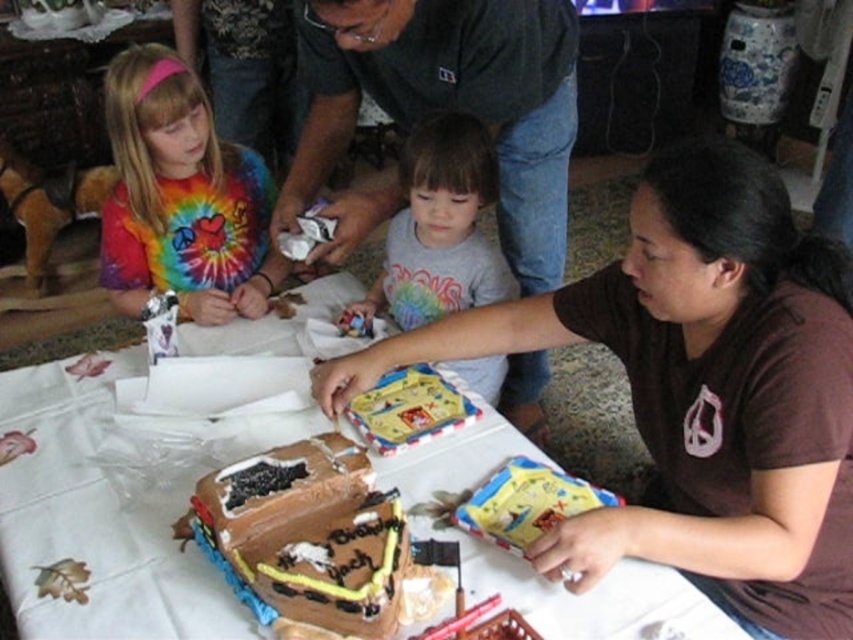
Between dark gray shirt at center and rainbow tie-dye shirt at center, which one has less height?

rainbow tie-dye shirt at center is shorter.

From the picture: Does dark gray shirt at center have a lesser height compared to rainbow tie-dye shirt at center?

No.

Is point (350, 42) in front of point (494, 246)?

Yes, it is in front of point (494, 246).

At what (x,y) coordinates should I click in order to perform the action: click on dark gray shirt at center. Please return your answer as a coordinate pair (x, y). This screenshot has width=853, height=640. Looking at the image, I should click on (450, 100).

Between chocolate fondant cake at center and rainbow tie-dye shirt at center, which one appears on the right side from the viewer's perspective?

Positioned to the right is rainbow tie-dye shirt at center.

Does chocolate fondant cake at center have a lesser height compared to rainbow tie-dye shirt at center?

Yes, chocolate fondant cake at center is shorter than rainbow tie-dye shirt at center.

Describe the element at coordinates (309, 532) in the screenshot. This screenshot has height=640, width=853. I see `chocolate fondant cake at center` at that location.

The height and width of the screenshot is (640, 853). Identify the location of chocolate fondant cake at center. (309, 532).

Is point (235, 164) positioned after point (209, 484)?

Yes, point (235, 164) is farther from viewer.

Can you confirm if tie-dye fabric shirt at upper left is smaller than chocolate fondant cake at center?

No, tie-dye fabric shirt at upper left is not smaller than chocolate fondant cake at center.

Between point (227, 278) and point (215, 513), which one is positioned behind?

The point (227, 278) is behind.

The image size is (853, 640). Find the location of `tie-dye fabric shirt at upper left`. tie-dye fabric shirt at upper left is located at coordinates (181, 196).